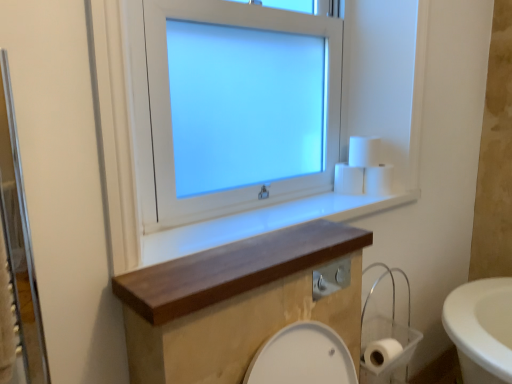
Identify the location of vacant space in front of white matte toilet paper at center, acting as the 2th toilet paper starting from the top. This screenshot has width=512, height=384. (339, 210).